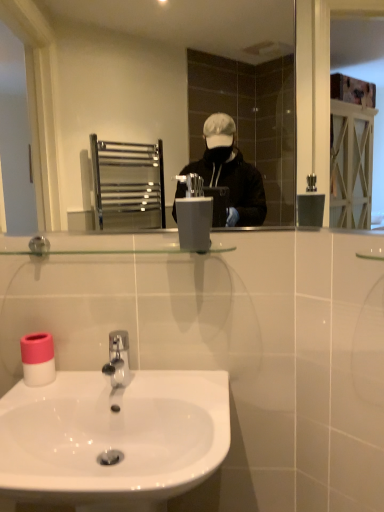
Question: Is metallic silver mirror at upper center at the right side of white matte toilet paper at lower left?

Choices:
 (A) no
 (B) yes

Answer: (B)

Question: From the image's perspective, would you say metallic silver mirror at upper center is shown under white matte toilet paper at lower left?

Choices:
 (A) yes
 (B) no

Answer: (B)

Question: Does metallic silver mirror at upper center have a larger size compared to white matte toilet paper at lower left?

Choices:
 (A) no
 (B) yes

Answer: (B)

Question: From a real-world perspective, is metallic silver mirror at upper center located higher than white matte toilet paper at lower left?

Choices:
 (A) no
 (B) yes

Answer: (B)

Question: Considering the relative sizes of metallic silver mirror at upper center and white matte toilet paper at lower left in the image provided, is metallic silver mirror at upper center smaller than white matte toilet paper at lower left?

Choices:
 (A) no
 (B) yes

Answer: (A)

Question: Is metallic silver mirror at upper center aimed at white matte toilet paper at lower left?

Choices:
 (A) yes
 (B) no

Answer: (B)

Question: Can you confirm if metallic silver mirror at upper center is shorter than white glossy sink at lower center?

Choices:
 (A) no
 (B) yes

Answer: (A)

Question: From the image's perspective, is metallic silver mirror at upper center located beneath white glossy sink at lower center?

Choices:
 (A) no
 (B) yes

Answer: (A)

Question: Does metallic silver mirror at upper center appear on the right side of white glossy sink at lower center?

Choices:
 (A) yes
 (B) no

Answer: (A)

Question: Can you confirm if metallic silver mirror at upper center is taller than white glossy sink at lower center?

Choices:
 (A) no
 (B) yes

Answer: (B)

Question: Considering the relative sizes of metallic silver mirror at upper center and white glossy sink at lower center in the image provided, is metallic silver mirror at upper center smaller than white glossy sink at lower center?

Choices:
 (A) yes
 (B) no

Answer: (A)

Question: Does metallic silver mirror at upper center lie in front of white glossy sink at lower center?

Choices:
 (A) no
 (B) yes

Answer: (A)

Question: Is white matte toilet paper at lower left positioned beyond the bounds of satin grey plastic at center?

Choices:
 (A) no
 (B) yes

Answer: (B)